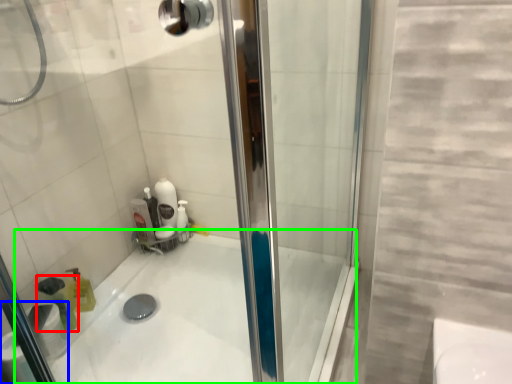
Question: Considering the real-world distances, which object is farthest from cleaning product (highlighted by a red box)? toilet paper (highlighted by a blue box) or bath (highlighted by a green box)?

Choices:
 (A) toilet paper
 (B) bath

Answer: (B)